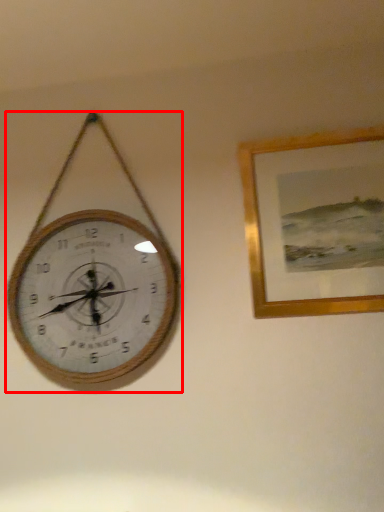
Question: From the image's perspective, what is the correct spatial positioning of wall clock (annotated by the red box) in reference to picture frame?

Choices:
 (A) below
 (B) above

Answer: (A)